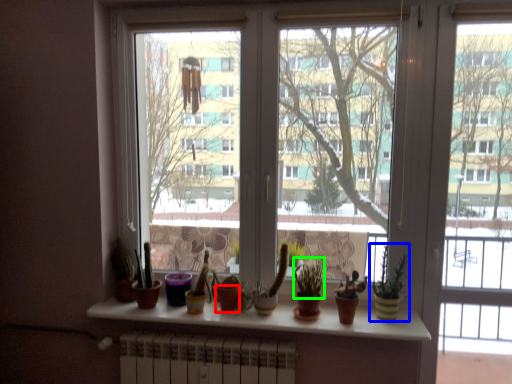
Question: Which object is the farthest from flowerpot (highlighted by a red box)? Choose among these: houseplant (highlighted by a blue box) or plant (highlighted by a green box).

Choices:
 (A) houseplant
 (B) plant

Answer: (A)